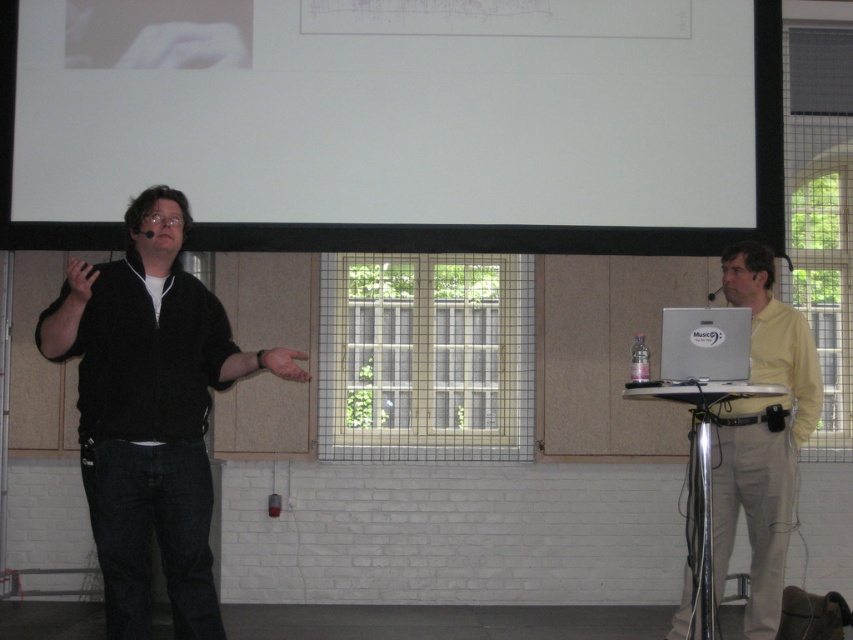
Does silver metallic computer at right appear on the left side of matte skin hand at center?

Incorrect, silver metallic computer at right is not on the left side of matte skin hand at center.

Is silver metallic computer at right below matte skin hand at center?

No, silver metallic computer at right is not below matte skin hand at center.

Is point (724, 324) less distant than point (283, 349)?

No, it is not.

Find the location of a particular element. The width and height of the screenshot is (853, 640). silver metallic computer at right is located at coordinates (704, 342).

Consider the image. Between white matte projection screen at upper center and yellow smooth shirt at right, which one has more height?

Standing taller between the two is yellow smooth shirt at right.

This screenshot has height=640, width=853. I want to click on white matte projection screen at upper center, so click(563, 225).

Does point (543, 234) come farther from viewer compared to point (770, 442)?

Yes.

Identify the location of white matte projection screen at upper center. The width and height of the screenshot is (853, 640). click(x=563, y=225).

Between white matte projection screen at upper center and silver metallic computer at right, which one has more height?

Standing taller between the two is white matte projection screen at upper center.

Where is `white matte projection screen at upper center`? The height and width of the screenshot is (640, 853). white matte projection screen at upper center is located at coordinates (563, 225).